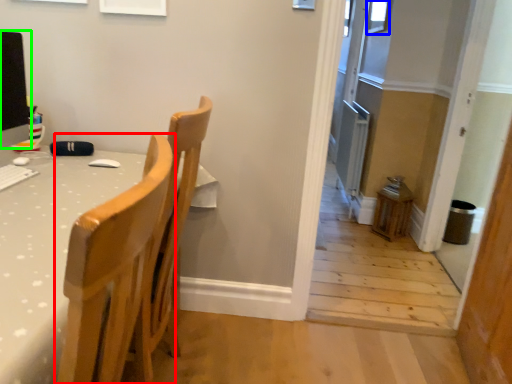
Question: Considering the real-world distances, which object is farthest from chair (highlighted by a red box)? window (highlighted by a blue box) or computer monitor (highlighted by a green box)?

Choices:
 (A) window
 (B) computer monitor

Answer: (A)